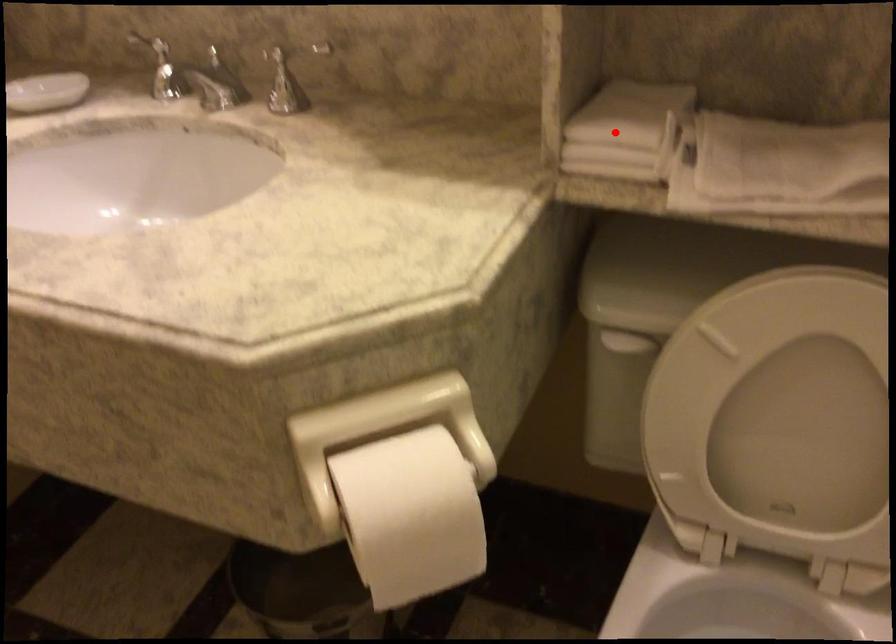
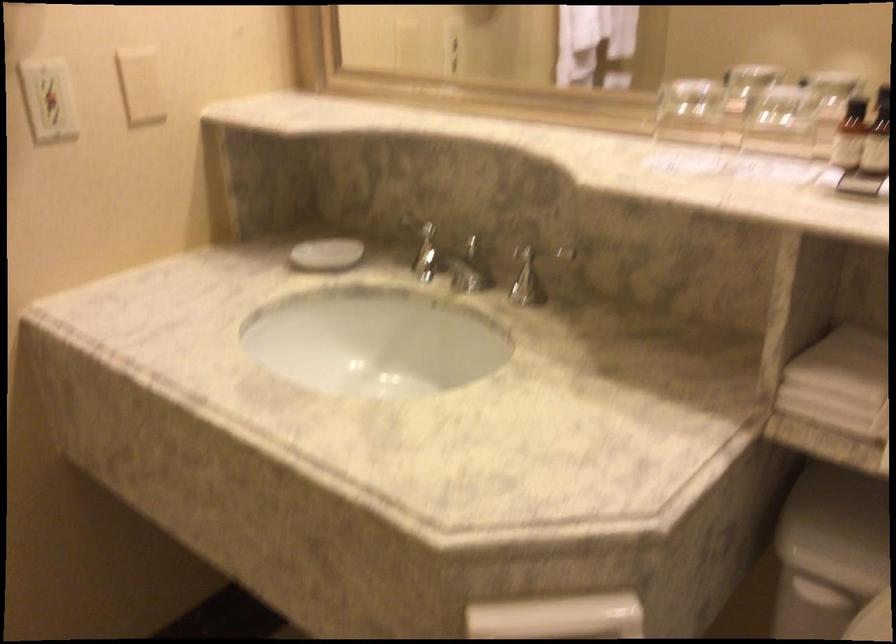
Question: I am providing you with two images of the same scene from different viewpoints. A red point is marked on the first image. Can you still see the location of the red point in image 2?

Choices:
 (A) Yes
 (B) No

Answer: (A)